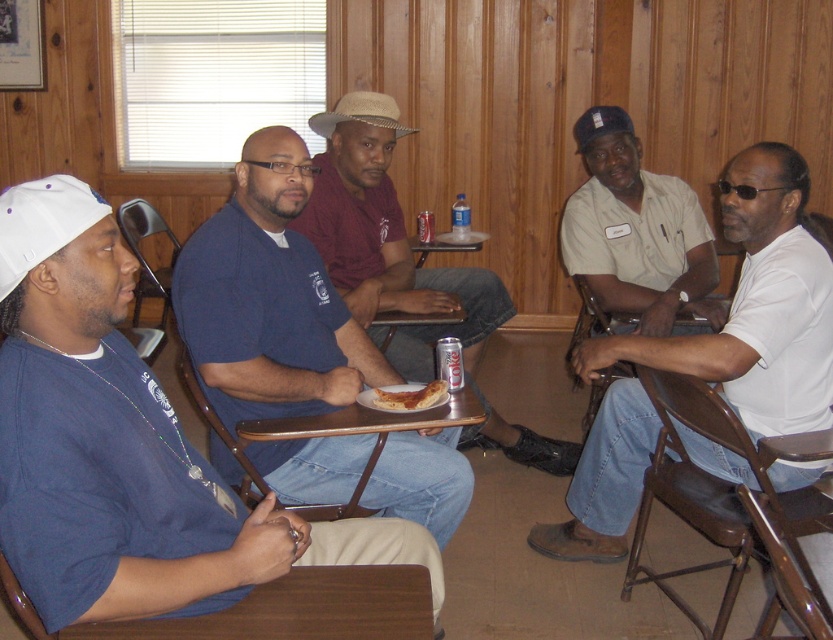
Question: Which point is closer to the camera taking this photo?

Choices:
 (A) (421, 260)
 (B) (372, 404)

Answer: (B)

Question: Which point is closer to the camera?

Choices:
 (A) matte blue shirt at center
 (B) wooden folding chair at left
 (C) brown wood table at center

Answer: (C)

Question: Which object is closer to the camera taking this photo?

Choices:
 (A) white shirt at right
 (B) khaki uniform shirt at center

Answer: (A)

Question: Can you confirm if khaki uniform shirt at center is smaller than wooden folding chair at left?

Choices:
 (A) no
 (B) yes

Answer: (A)

Question: Does brown wood folding chair at lower right have a smaller size compared to golden crispy pizza slice at center?

Choices:
 (A) no
 (B) yes

Answer: (A)

Question: Is wooden folding chair at left to the left of golden crispy pizza slice at center from the viewer's perspective?

Choices:
 (A) no
 (B) yes

Answer: (B)